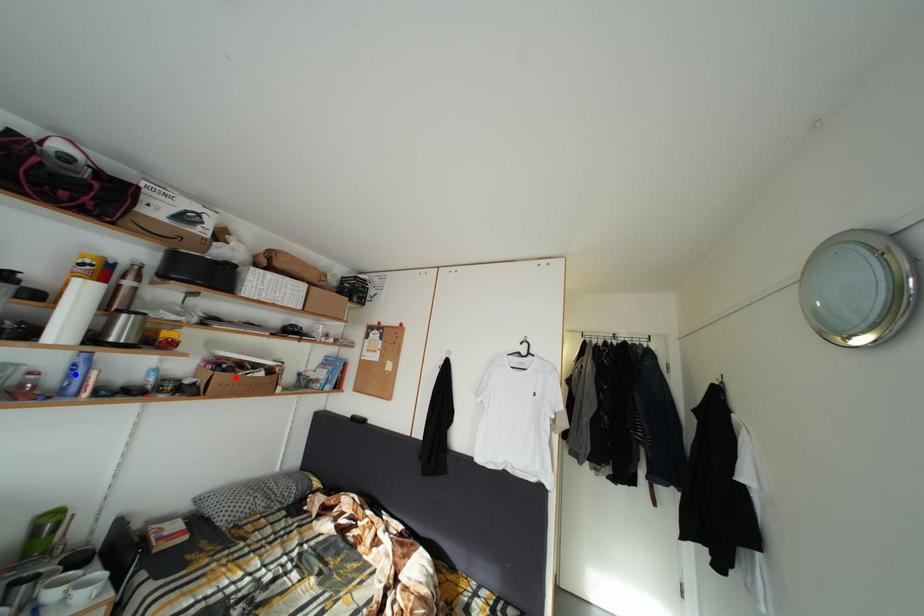
Question: In the image, two points are highlighted. Which point is nearer to the camera? Reply with the corresponding letter.

Choices:
 (A) blue point
 (B) red point

Answer: (A)